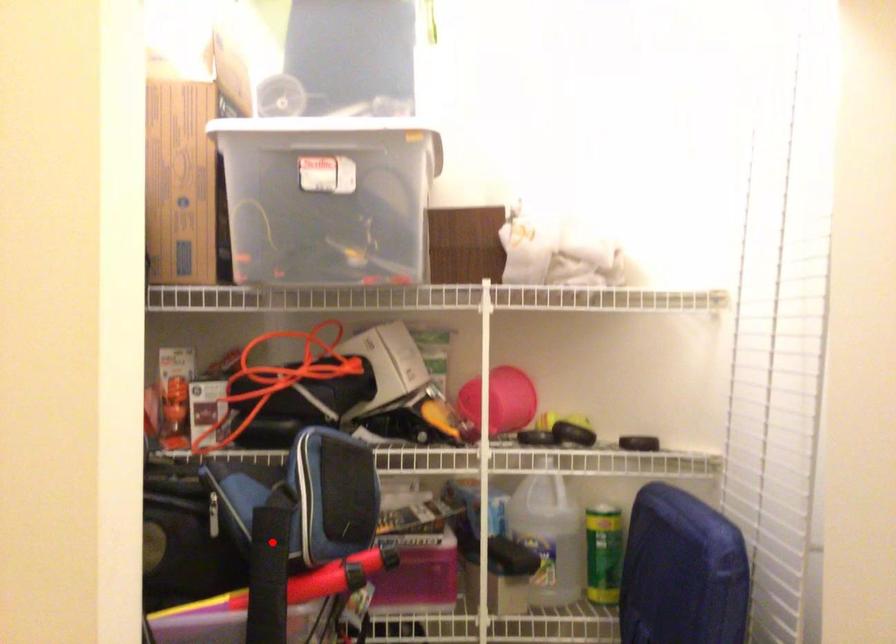
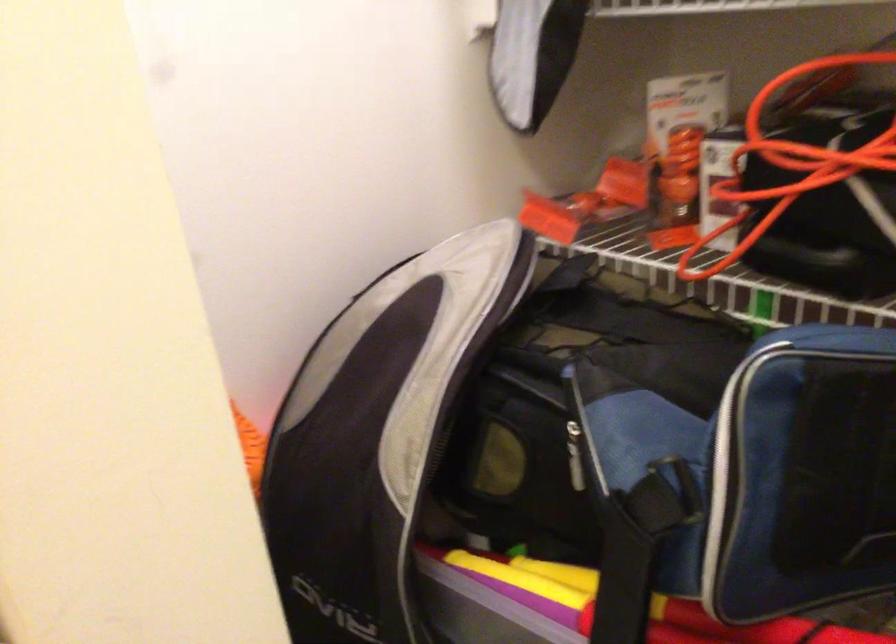
Question: A red point is marked in image1. In image2, is the corresponding 3D point closer to the camera or farther? Reply with the corresponding letter.

Choices:
 (A) The corresponding 3D point is closer.
 (B) The corresponding 3D point is farther.

Answer: (A)